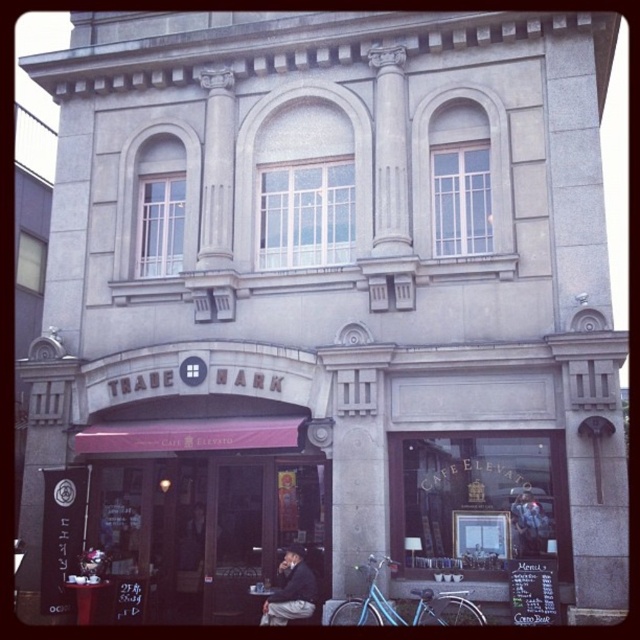
Based on the photo, you are a customer entering the building and notice the matte pink awning at lower left and the dark gray jacket at center. Which object appears smaller in size?

The matte pink awning at lower left appears smaller in size compared to the dark gray jacket at center.

You are a customer entering the building and see the matte pink awning at lower left and the dark gray suit at center. Which object is closer to the entrance?

The matte pink awning at lower left is closer to the entrance than the dark gray suit at center.